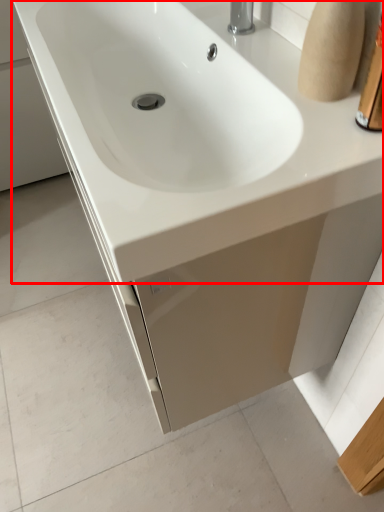
Question: From the image's perspective, considering the relative positions of sink (annotated by the red box) and toiletry in the image provided, where is sink (annotated by the red box) located with respect to the staircase?

Choices:
 (A) above
 (B) below

Answer: (A)